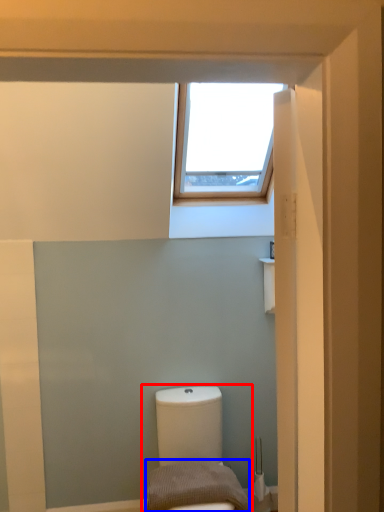
Question: Among these objects, which one is farthest to the camera, toilet (highlighted by a red box) or pillow (highlighted by a blue box)?

Choices:
 (A) toilet
 (B) pillow

Answer: (B)